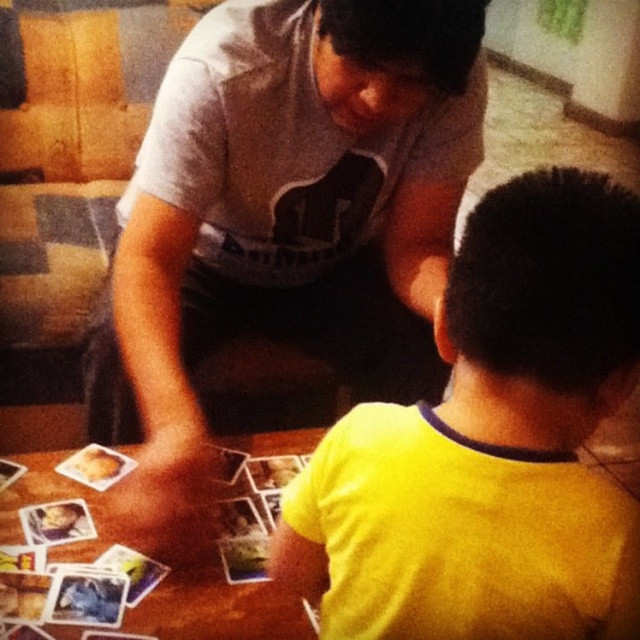
Question: Which of these objects is positioned farthest from the yellow matte shirt at lower right?

Choices:
 (A) gray cotton shirt at upper center
 (B) wooden table at lower left

Answer: (A)

Question: Based on their relative distances, which object is nearer to the yellow matte shirt at lower right?

Choices:
 (A) gray cotton shirt at upper center
 (B) wooden table at lower left

Answer: (B)

Question: Is gray cotton shirt at upper center below yellow matte shirt at lower right?

Choices:
 (A) no
 (B) yes

Answer: (A)

Question: Is the position of yellow matte shirt at lower right more distant than that of wooden table at lower left?

Choices:
 (A) no
 (B) yes

Answer: (A)

Question: Is gray cotton shirt at upper center to the left of yellow matte shirt at lower right from the viewer's perspective?

Choices:
 (A) no
 (B) yes

Answer: (B)

Question: Which object appears farthest from the camera in this image?

Choices:
 (A) wooden table at lower left
 (B) yellow matte shirt at lower right

Answer: (A)